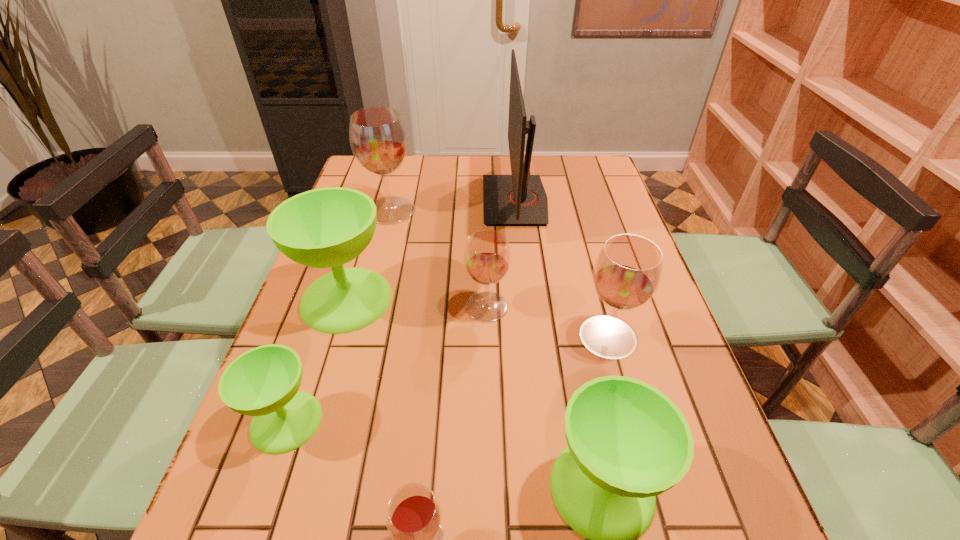
Find the location of a particular element. This screenshot has height=540, width=960. free space located on the screen side of the monitor is located at coordinates (366, 200).

Find the location of a particular element. Image resolution: width=960 pixels, height=540 pixels. vacant area situated 0.250m on the screen side of the monitor is located at coordinates (406, 200).

Locate an element on the screen. vacant space situated 0.370m on the right of the tallest wineglass is located at coordinates (533, 211).

Locate an element on the screen. The image size is (960, 540). free space located 0.300m on the left of the rightmost red wineglass is located at coordinates (449, 336).

Where is `vacant space situated on the right of the farthest green wineglass`? The height and width of the screenshot is (540, 960). vacant space situated on the right of the farthest green wineglass is located at coordinates (531, 299).

Locate an element on the screen. The image size is (960, 540). blank area located on the left of the third biggest red wineglass is located at coordinates (368, 307).

The image size is (960, 540). I want to click on free space located on the front of the smallest green wineglass, so click(x=245, y=539).

Find the location of a particular element. Image resolution: width=960 pixels, height=540 pixels. object positioned at the far edge is located at coordinates (519, 199).

The image size is (960, 540). Identify the location of object situated at the right edge. (627, 272).

I want to click on vacant space at the left edge, so click(368, 194).